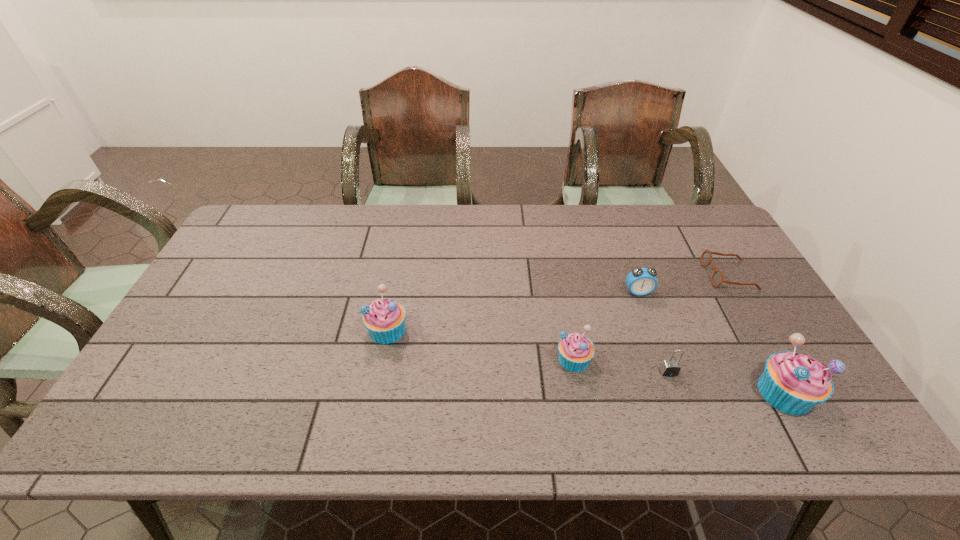
The width and height of the screenshot is (960, 540). Find the location of `empty space that is in between the spectacles and the alarm clock`. empty space that is in between the spectacles and the alarm clock is located at coordinates 684,284.

Identify the location of free area in between the alarm clock and the spectacles. (684, 284).

You are a GUI agent. You are given a task and a screenshot of the screen. Output one action in this format:
    pyautogui.click(x=<x>, y=<y>)
    Task: Click on the free space between the rightmost muffin and the shortest object
    
    Given the screenshot: What is the action you would take?
    pyautogui.click(x=756, y=334)

Image resolution: width=960 pixels, height=540 pixels. I want to click on blank region between the leftmost object and the fifth object from right to left, so click(x=481, y=345).

Locate which object ranks second in proximity to the second shortest muffin. Please provide its 2D coordinates. Your answer should be formatted as a tuple, i.e. [(x, y)], where the tuple contains the x and y coordinates of a point satisfying the conditions above.

[(641, 281)]

Select which object is the second closest to the alarm clock. Please provide its 2D coordinates. Your answer should be formatted as a tuple, i.e. [(x, y)], where the tuple contains the x and y coordinates of a point satisfying the conditions above.

[(576, 351)]

Select which muffin appears as the second closest to the padlock. Please provide its 2D coordinates. Your answer should be formatted as a tuple, i.e. [(x, y)], where the tuple contains the x and y coordinates of a point satisfying the conditions above.

[(793, 383)]

Select which muffin appears as the third closest to the shortest object. Please provide its 2D coordinates. Your answer should be formatted as a tuple, i.e. [(x, y)], where the tuple contains the x and y coordinates of a point satisfying the conditions above.

[(384, 319)]

Where is `free region that satisfies the following two spatial constraints: 1. on the shackle of the tallest muffin; 2. on the left side of the padlock`? free region that satisfies the following two spatial constraints: 1. on the shackle of the tallest muffin; 2. on the left side of the padlock is located at coordinates (676, 393).

The width and height of the screenshot is (960, 540). I want to click on vacant region that satisfies the following two spatial constraints: 1. on the face of the alarm clock; 2. on the right side of the tallest object, so click(674, 393).